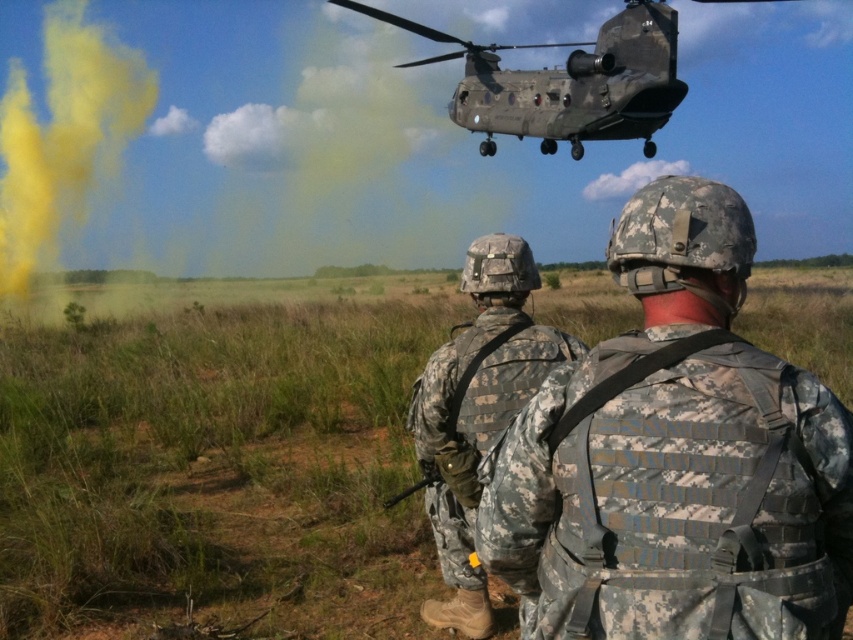
You are a drone operator observing the military scene. You need to determine which object is closer to the ground based on their heights. The objects are the camouflage fabric uniform at center and the camouflage paint helicopter at upper center. Which one is closer to the ground?

The camouflage fabric uniform at center is shorter than the camouflage paint helicopter at upper center, so the camouflage fabric uniform at center is closer to the ground.

You are a soldier in the field and need to quickly identify the nearest object between the camouflage fabric uniform at center and the camouflage paint helicopter at upper center. Which one should you report as closer to your position?

The camouflage fabric uniform at center is closer to the viewer than the camouflage paint helicopter at upper center, so you should report the camouflage fabric uniform at center as the closer object.

You are a drone operator controlling a small drone that needs to fly between the camouflage fabric vest at center and the camouflage fabric uniform at center. The drone has a wingspan of 1 meter. Can the drone safely pass through the space between them?

The distance between the camouflage fabric vest at center and the camouflage fabric uniform at center is 1.17 meters. Since the drone has a wingspan of 1 meter, it can safely pass through the space between them as there is enough clearance.